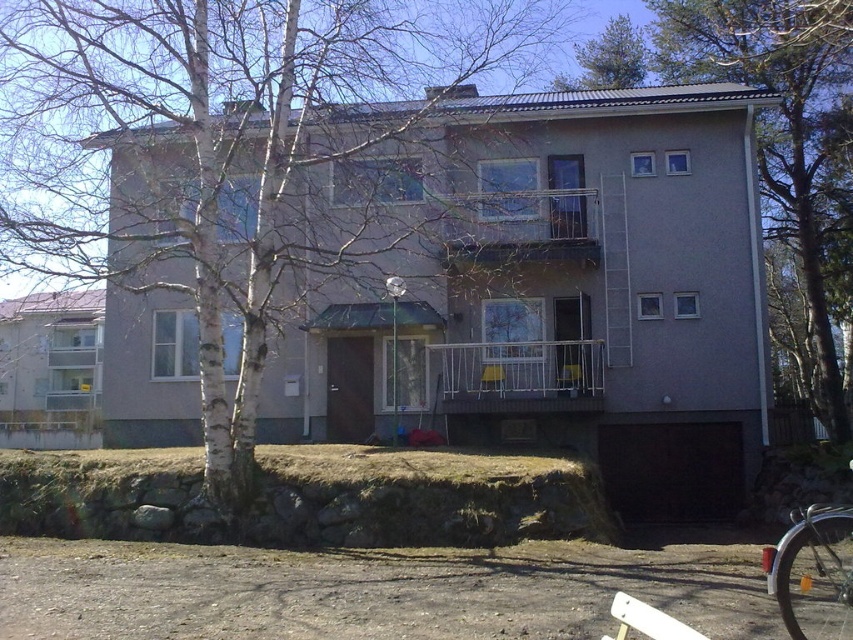
Question: Does silver metallic bicycle at lower right have a smaller size compared to green leafy tree at upper center?

Choices:
 (A) no
 (B) yes

Answer: (B)

Question: Is white bark tree at center wider than green leafy tree at upper right?

Choices:
 (A) yes
 (B) no

Answer: (A)

Question: Which of the following is the closest to the observer?

Choices:
 (A) green leafy tree at upper center
 (B) green leafy tree at upper right

Answer: (B)

Question: Where is green leafy tree at upper right located in relation to silver metallic bicycle at lower right in the image?

Choices:
 (A) left
 (B) right

Answer: (B)

Question: Which object appears closest to the camera in this image?

Choices:
 (A) green leafy tree at upper center
 (B) green leafy tree at upper right

Answer: (B)

Question: Among these objects, which one is nearest to the camera?

Choices:
 (A) green leafy tree at upper right
 (B) silver metallic bicycle at lower right
 (C) green leafy tree at upper center

Answer: (B)